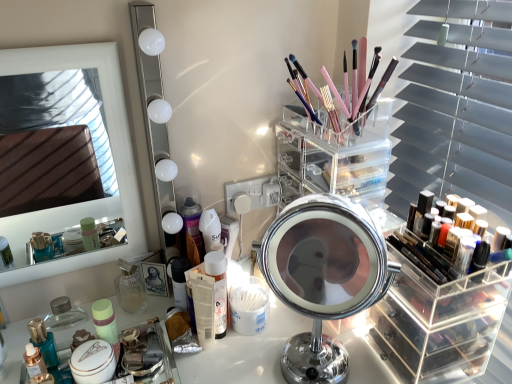
Question: Can you confirm if shiny metallic perfume at lower left, the 4th toiletry viewed from the right, is smaller than clear acrylic organizer at center, positioned as the 1th shelf in left-to-right order?

Choices:
 (A) yes
 (B) no

Answer: (A)

Question: Considering the relative positions of shiny metallic perfume at lower left, the 1th toiletry viewed from the left, and clear acrylic organizer at center, acting as the 2th shelf starting from the bottom, in the image provided, is shiny metallic perfume at lower left, the 1th toiletry viewed from the left, to the right of clear acrylic organizer at center, acting as the 2th shelf starting from the bottom, from the viewer's perspective?

Choices:
 (A) no
 (B) yes

Answer: (A)

Question: Is shiny metallic perfume at lower left, the 1th toiletry viewed from the left, next to clear acrylic organizer at center, positioned as the 1th shelf in left-to-right order?

Choices:
 (A) no
 (B) yes

Answer: (A)

Question: From a real-world perspective, is shiny metallic perfume at lower left, the 4th toiletry viewed from the right, under clear acrylic organizer at center, placed as the first shelf when sorted from top to bottom?

Choices:
 (A) no
 (B) yes

Answer: (B)

Question: Considering the relative sizes of shiny metallic perfume at lower left, the 1th toiletry viewed from the left, and clear acrylic organizer at center, marked as the 2th shelf in a right-to-left arrangement, in the image provided, is shiny metallic perfume at lower left, the 1th toiletry viewed from the left, shorter than clear acrylic organizer at center, marked as the 2th shelf in a right-to-left arrangement,?

Choices:
 (A) yes
 (B) no

Answer: (A)

Question: From a real-world perspective, is matte black makeup artist at center positioned above or below shiny black nail polish at right, marked as the 1th toiletry in a right-to-left arrangement?

Choices:
 (A) above
 (B) below

Answer: (B)

Question: From the image's perspective, is matte black makeup artist at center located above or below shiny black nail polish at right, marked as the 1th toiletry in a right-to-left arrangement?

Choices:
 (A) below
 (B) above

Answer: (A)

Question: In terms of width, does matte black makeup artist at center look wider or thinner when compared to shiny black nail polish at right, acting as the fourth toiletry starting from the left?

Choices:
 (A) thin
 (B) wide

Answer: (A)

Question: In the image, is matte black makeup artist at center positioned in front of or behind shiny black nail polish at right, acting as the fourth toiletry starting from the left?

Choices:
 (A) behind
 (B) front

Answer: (A)

Question: In terms of width, does chrome/metallic mirror at center, arranged as the 1th mirror when viewed from the right, look wider or thinner when compared to clear acrylic makeup organizer at right, which is the 2th shelf from top to bottom?

Choices:
 (A) wide
 (B) thin

Answer: (B)

Question: Do you think chrome/metallic mirror at center, arranged as the 1th mirror when viewed from the right, is within clear acrylic makeup organizer at right, marked as the 1th shelf in a bottom-to-top arrangement, or outside of it?

Choices:
 (A) inside
 (B) outside

Answer: (B)

Question: Does point (352, 294) appear closer or farther from the camera than point (419, 296)?

Choices:
 (A) farther
 (B) closer

Answer: (B)

Question: From a real-world perspective, relative to clear acrylic makeup organizer at right, acting as the first shelf starting from the right, is chrome/metallic mirror at center, arranged as the 1th mirror when viewed from the right, vertically above or below?

Choices:
 (A) below
 (B) above

Answer: (B)

Question: Considering the positions of clear acrylic makeup organizer at right, marked as the 1th shelf in a bottom-to-top arrangement, and shiny black nail polish at right, acting as the fourth toiletry starting from the left, in the image, is clear acrylic makeup organizer at right, marked as the 1th shelf in a bottom-to-top arrangement, wider or thinner than shiny black nail polish at right, acting as the fourth toiletry starting from the left,?

Choices:
 (A) thin
 (B) wide

Answer: (B)

Question: Would you say clear acrylic makeup organizer at right, marked as the 1th shelf in a bottom-to-top arrangement, is inside or outside shiny black nail polish at right, acting as the fourth toiletry starting from the left?

Choices:
 (A) outside
 (B) inside

Answer: (A)